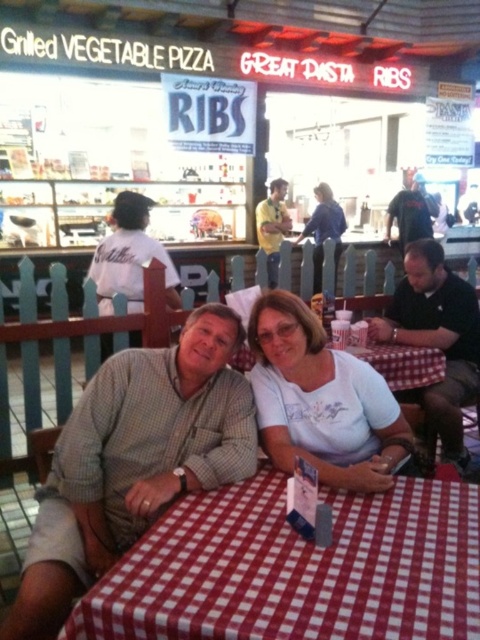
Question: Which object is closer to the camera taking this photo?

Choices:
 (A) dark blue t-shirt at upper right
 (B) checkered shirt at center
 (C) blue denim shirt at center

Answer: (B)

Question: Can you confirm if red checkered tablecloth at center is positioned to the right of yellow shirt at center?

Choices:
 (A) yes
 (B) no

Answer: (B)

Question: Is white cotton shirt at upper left smaller than yellow shirt at center?

Choices:
 (A) yes
 (B) no

Answer: (B)

Question: Estimate the real-world distances between objects in this image. Which object is closer to the dark blue t-shirt at upper right?

Choices:
 (A) checkered shirt at center
 (B) white cotton shirt at upper left

Answer: (B)

Question: Which point appears closest to the camera in this image?

Choices:
 (A) [x=314, y=216]
 (B) [x=245, y=394]

Answer: (B)

Question: Is black shirt at right thinner than dark blue t-shirt at upper right?

Choices:
 (A) no
 (B) yes

Answer: (A)